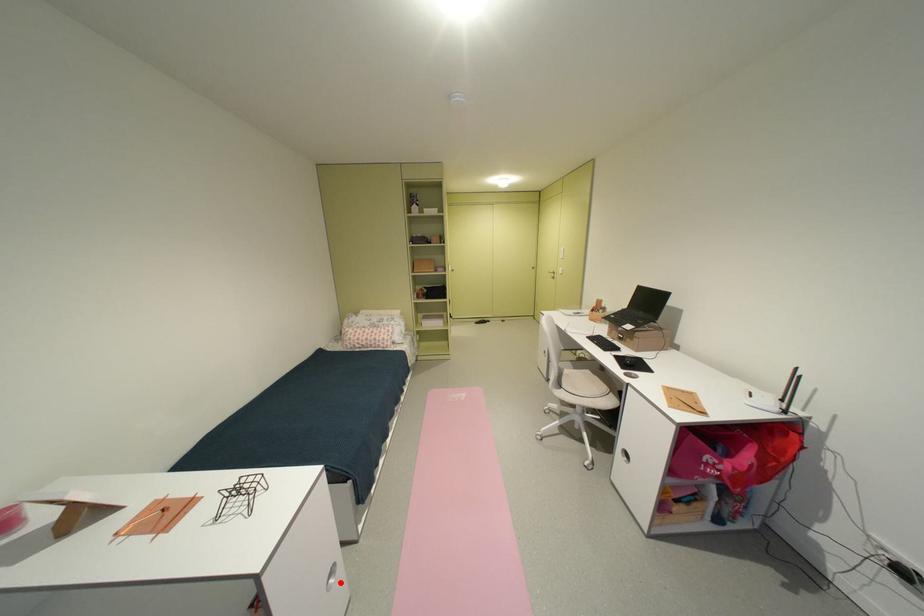
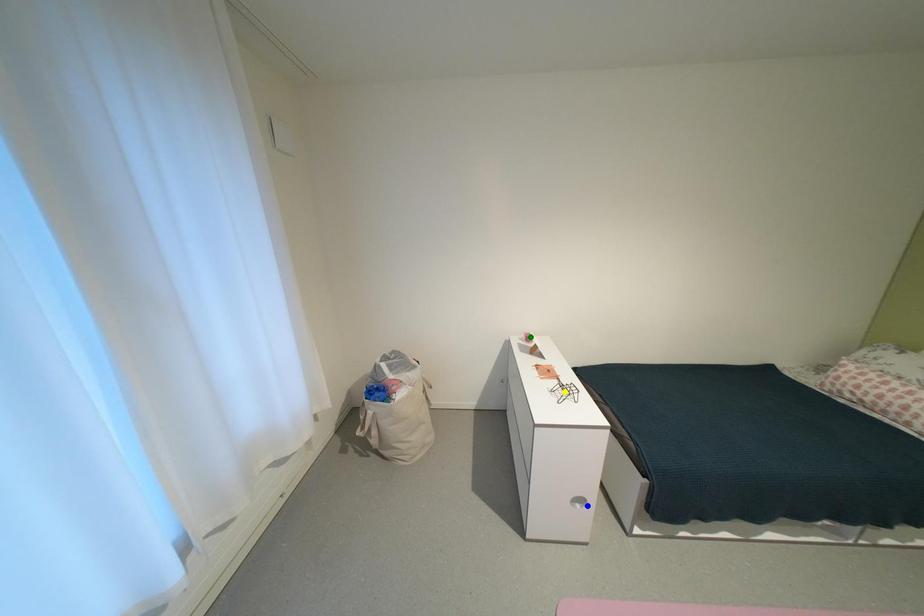
Question: I am providing you with two images of the same scene from different viewpoints. A red point is marked on the first image. You are given multiple points on the second image. Can you choose the point in image 2 that corresponds to the point in image 1?

Choices:
 (A) green point
 (B) blue point
 (C) yellow point

Answer: (B)